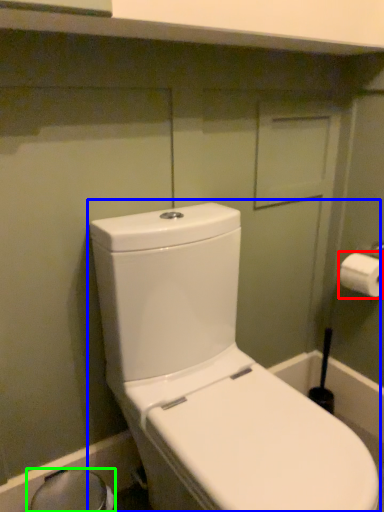
Question: Based on their relative distances, which object is farther from toilet paper (highlighted by a red box)? Choose from toilet (highlighted by a blue box) and bidet (highlighted by a green box).

Choices:
 (A) toilet
 (B) bidet

Answer: (B)